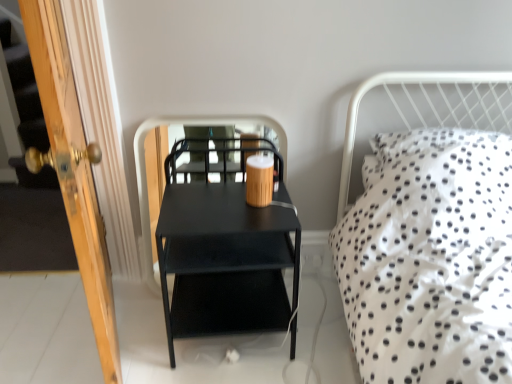
Question: Does wooden door at left have a smaller size compared to wooden coffee cup at center?

Choices:
 (A) no
 (B) yes

Answer: (A)

Question: Is wooden door at left beside wooden coffee cup at center?

Choices:
 (A) no
 (B) yes

Answer: (A)

Question: Is wooden door at left shorter than wooden coffee cup at center?

Choices:
 (A) no
 (B) yes

Answer: (A)

Question: Is wooden door at left thinner than wooden coffee cup at center?

Choices:
 (A) no
 (B) yes

Answer: (A)

Question: From a real-world perspective, is wooden door at left located beneath wooden coffee cup at center?

Choices:
 (A) yes
 (B) no

Answer: (A)

Question: Is wooden coffee cup at center taller or shorter than black matte side table at center?

Choices:
 (A) tall
 (B) short

Answer: (B)

Question: From the image's perspective, is wooden coffee cup at center located above or below black matte side table at center?

Choices:
 (A) above
 (B) below

Answer: (A)

Question: Considering the relative positions of wooden coffee cup at center and black matte side table at center in the image provided, is wooden coffee cup at center to the left or to the right of black matte side table at center?

Choices:
 (A) right
 (B) left

Answer: (A)

Question: Relative to black matte side table at center, is wooden coffee cup at center in front or behind?

Choices:
 (A) front
 (B) behind

Answer: (A)

Question: Which is correct: matte black nightstand at center is inside wooden door at left, or outside of it?

Choices:
 (A) inside
 (B) outside

Answer: (B)

Question: Is matte black nightstand at center taller or shorter than wooden door at left?

Choices:
 (A) tall
 (B) short

Answer: (B)

Question: From a real-world perspective, is matte black nightstand at center positioned above or below wooden door at left?

Choices:
 (A) below
 (B) above

Answer: (A)

Question: In the image, is matte black nightstand at center on the left side or the right side of wooden door at left?

Choices:
 (A) left
 (B) right

Answer: (B)

Question: From their relative heights in the image, would you say black matte side table at center is taller or shorter than wooden coffee cup at center?

Choices:
 (A) tall
 (B) short

Answer: (A)

Question: From a real-world perspective, relative to wooden coffee cup at center, is black matte side table at center vertically above or below?

Choices:
 (A) above
 (B) below

Answer: (B)